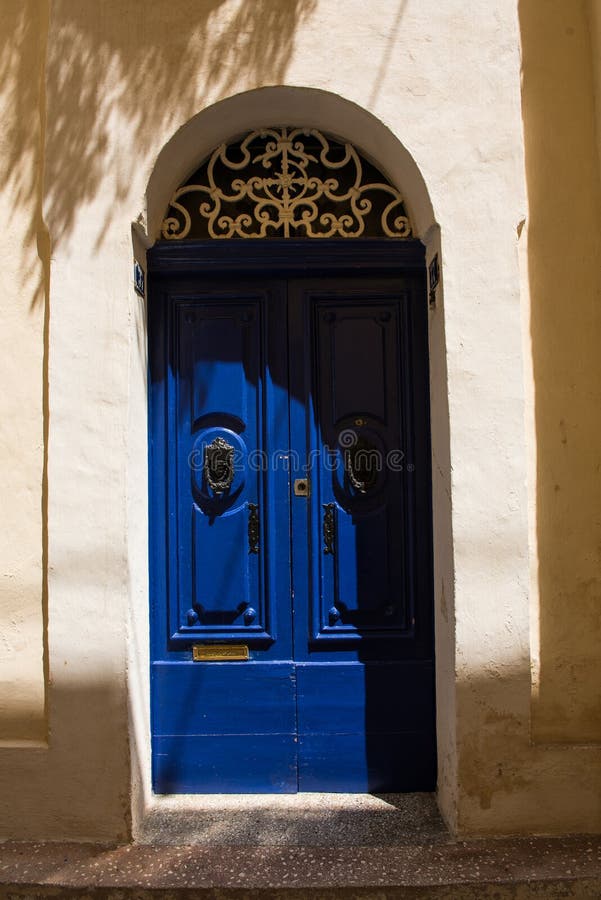
Where is `ornament above the door`? ornament above the door is located at coordinates (287, 212).